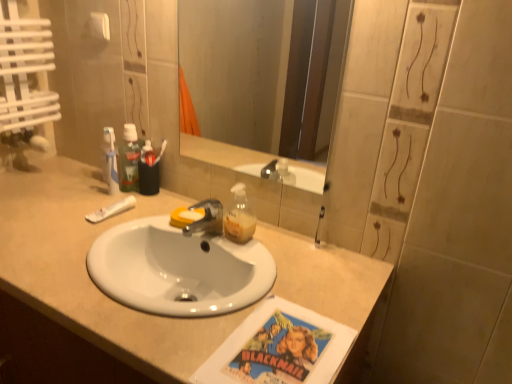
The height and width of the screenshot is (384, 512). What do you see at coordinates (111, 210) in the screenshot? I see `white matte tube at left` at bounding box center [111, 210].

At what (x,y) coordinates should I click in order to perform the action: click on green plastic mouthwash at upper left. Please return your answer as a coordinate pair (x, y). Looking at the image, I should click on (129, 160).

From their relative heights in the image, would you say metallic silver tap at center is taller or shorter than clear glass mirror at upper center?

Considering their sizes, metallic silver tap at center has less height than clear glass mirror at upper center.

Is clear glass mirror at upper center at the back of metallic silver tap at center?

No, metallic silver tap at center is not facing the opposite direction of clear glass mirror at upper center.

From the picture: Which point is more distant from viewer, [217,223] or [279,109]?

Point [279,109]

From a real-world perspective, which is physically above, green plastic mouthwash at upper left or clear glass mirror at upper center?

clear glass mirror at upper center.

From the image's perspective, is green plastic mouthwash at upper left under clear glass mirror at upper center?

Yes, from the image's perspective, green plastic mouthwash at upper left is beneath clear glass mirror at upper center.

Based on the photo, considering the sizes of green plastic mouthwash at upper left and clear glass mirror at upper center in the image, is green plastic mouthwash at upper left wider or thinner than clear glass mirror at upper center?

In the image, green plastic mouthwash at upper left appears to be wider than clear glass mirror at upper center.

Which object is closer to the camera taking this photo, green plastic mouthwash at upper left or clear glass mirror at upper center?

clear glass mirror at upper center is closer to the camera.

Is clear glass mirror at upper center at the left side of beige laminate countertop at center?

Incorrect, clear glass mirror at upper center is not on the left side of beige laminate countertop at center.

From a real-world perspective, is clear glass mirror at upper center on beige laminate countertop at center?

A: Yes.

From the image's perspective, between clear glass mirror at upper center and beige laminate countertop at center, which one is located above?

From the image's view, clear glass mirror at upper center is above.

Is clear glass mirror at upper center not near beige laminate countertop at center?

Yes, clear glass mirror at upper center and beige laminate countertop at center are located far from each other.

Looking at this image, how different are the orientations of green plastic mouthwash at upper left and beige laminate countertop at center in degrees?

The angle between the facing direction of green plastic mouthwash at upper left and the facing direction of beige laminate countertop at center is 1.04 degrees.

Considering the positions of objects green plastic mouthwash at upper left and beige laminate countertop at center in the image provided, who is in front, green plastic mouthwash at upper left or beige laminate countertop at center?

beige laminate countertop at center is in front.

Considering the relative sizes of green plastic mouthwash at upper left and beige laminate countertop at center in the image provided, is green plastic mouthwash at upper left wider than beige laminate countertop at center?

No.

Are green plastic mouthwash at upper left and beige laminate countertop at center making contact?

No, green plastic mouthwash at upper left is not next to beige laminate countertop at center.

Where is `mouthwash above the white matte tube at left (from the image's perspective)`? Image resolution: width=512 pixels, height=384 pixels. mouthwash above the white matte tube at left (from the image's perspective) is located at coordinates [129, 160].

Based on the photo, from the image's perspective, is green plastic mouthwash at upper left above white matte tube at left?

Yes, from the image's perspective, green plastic mouthwash at upper left is above white matte tube at left.

Is green plastic mouthwash at upper left wider than white matte tube at left?

Incorrect, the width of green plastic mouthwash at upper left does not surpass that of white matte tube at left.

Between point (132, 162) and point (105, 212), which one is positioned behind?

Point (132, 162)

Consider the image. Can we say clear glass mirror at upper center lies outside metallic silver tap at center?

Yes, clear glass mirror at upper center is outside of metallic silver tap at center.

Can you confirm if clear glass mirror at upper center is thinner than metallic silver tap at center?

Yes, clear glass mirror at upper center is thinner than metallic silver tap at center.

Based on the photo, looking at the image, does clear glass mirror at upper center seem bigger or smaller compared to metallic silver tap at center?

clear glass mirror at upper center is bigger than metallic silver tap at center.

Is clear glass mirror at upper center in contact with metallic silver tap at center?

No.

In order to click on mouthwash above the metallic silver tap at center (from a real-world perspective) in this screenshot , I will do `click(129, 160)`.

Can you confirm if metallic silver tap at center is smaller than green plastic mouthwash at upper left?

Correct, metallic silver tap at center occupies less space than green plastic mouthwash at upper left.

Is green plastic mouthwash at upper left located within metallic silver tap at center?

No, green plastic mouthwash at upper left is not inside metallic silver tap at center.

How many degrees apart are the facing directions of metallic silver tap at center and green plastic mouthwash at upper left?

The facing directions of metallic silver tap at center and green plastic mouthwash at upper left are 0.0007 degrees apart.

Identify the location of tap located underneath the clear glass mirror at upper center (from a real-world perspective). (207, 219).

Where is `mirror to the right of green plastic mouthwash at upper left`? This screenshot has width=512, height=384. mirror to the right of green plastic mouthwash at upper left is located at coordinates (262, 72).

Considering their positions, is white matte tube at left positioned closer to beige laminate countertop at center than clear glass mirror at upper center?

white matte tube at left.

When comparing their distances from clear glass mirror at upper center, does metallic silver tap at center or white matte tube at left seem closer?

Among the two, metallic silver tap at center is located nearer to clear glass mirror at upper center.

Based on their spatial positions, is beige laminate countertop at center or metallic silver tap at center closer to clear glass mirror at upper center?

beige laminate countertop at center is positioned closer to the anchor clear glass mirror at upper center.

Considering their positions, is white matte tube at left positioned closer to clear glass mirror at upper center than green plastic mouthwash at upper left?

Based on the image, green plastic mouthwash at upper left appears to be nearer to clear glass mirror at upper center.

When comparing their distances from metallic silver tap at center, does beige laminate countertop at center or green plastic mouthwash at upper left seem closer?

Based on the image, green plastic mouthwash at upper left appears to be nearer to metallic silver tap at center.

Considering their positions, is white matte tube at left positioned further to metallic silver tap at center than green plastic mouthwash at upper left?

green plastic mouthwash at upper left.

Estimate the real-world distances between objects in this image. Which object is closer to beige laminate countertop at center, white matte tube at left or metallic silver tap at center?

Among the two, white matte tube at left is located nearer to beige laminate countertop at center.

In the scene shown: From the image, which object appears to be nearer to metallic silver tap at center, clear glass mirror at upper center or white matte tube at left?

Based on the image, white matte tube at left appears to be nearer to metallic silver tap at center.

Where is `mouthwash between clear glass mirror at upper center and beige laminate countertop at center from top to bottom`? The image size is (512, 384). mouthwash between clear glass mirror at upper center and beige laminate countertop at center from top to bottom is located at coordinates (129, 160).

Where is `mouthwash located between white matte tube at left and clear glass mirror at upper center in the left-right direction`? mouthwash located between white matte tube at left and clear glass mirror at upper center in the left-right direction is located at coordinates (129, 160).

Find the location of `mouthwash located between white matte tube at left and metallic silver tap at center in the left-right direction`. mouthwash located between white matte tube at left and metallic silver tap at center in the left-right direction is located at coordinates (129, 160).

Locate an element on the screen. tap between clear glass mirror at upper center and beige laminate countertop at center from top to bottom is located at coordinates (207, 219).